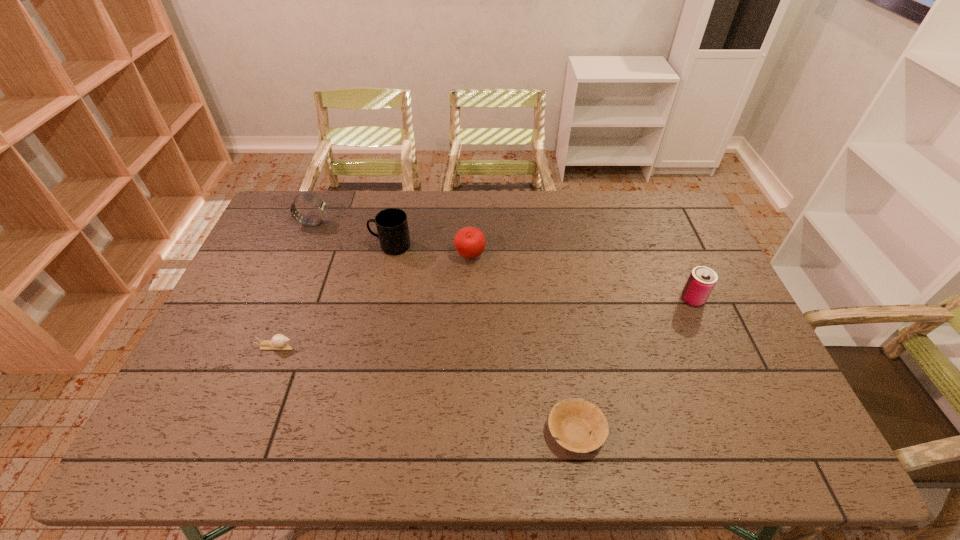
Locate an element on the screen. Image resolution: width=960 pixels, height=540 pixels. vacant space in between the fourth object from right to left and the apple is located at coordinates (431, 251).

At what (x,y) coordinates should I click in order to perform the action: click on free space between the mug and the watch. Please return your answer as a coordinate pair (x, y). The width and height of the screenshot is (960, 540). Looking at the image, I should click on (352, 234).

Where is `vacant area between the escargot and the nearest object`? vacant area between the escargot and the nearest object is located at coordinates (426, 389).

Find the location of a particular element. This screenshot has height=540, width=960. free point between the third object from left to right and the second nearest object is located at coordinates (333, 296).

Identify the location of free space that is in between the can and the watch. The image size is (960, 540). (503, 261).

This screenshot has width=960, height=540. In order to click on empty space between the fourth object from right to left and the escargot in this screenshot , I will do `click(333, 296)`.

Image resolution: width=960 pixels, height=540 pixels. I want to click on object that is the closest one to the bowl, so click(702, 280).

Identify the location of object that is the second closest to the second object from right to left. (470, 242).

Where is `vacant area that satisfies the following two spatial constraints: 1. on the side of the rightmost object with the handle; 2. on the right side of the fourth object from right to left`? vacant area that satisfies the following two spatial constraints: 1. on the side of the rightmost object with the handle; 2. on the right side of the fourth object from right to left is located at coordinates click(380, 299).

Locate an element on the screen. This screenshot has width=960, height=540. free space that satisfies the following two spatial constraints: 1. on the back side of the second object from right to left; 2. on the face of the watch is located at coordinates (543, 223).